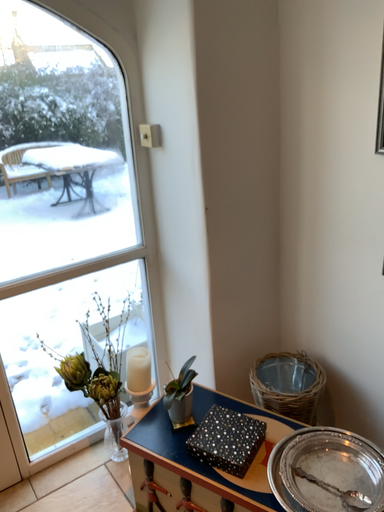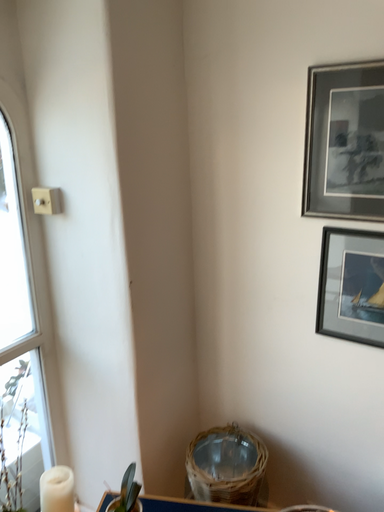
Question: Which way did the camera rotate in the video?

Choices:
 (A) rotated downward
 (B) rotated upward

Answer: (B)